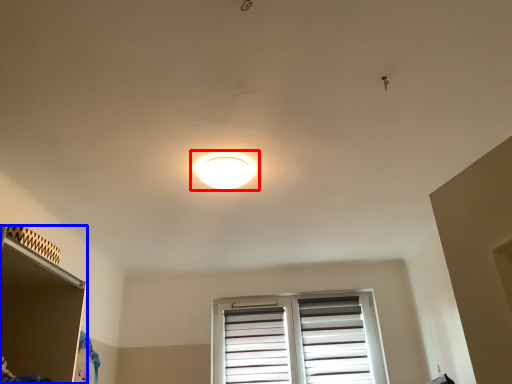
Question: Which of the following is the farthest to the observer, lamp (highlighted by a red box) or shelf (highlighted by a blue box)?

Choices:
 (A) lamp
 (B) shelf

Answer: (A)